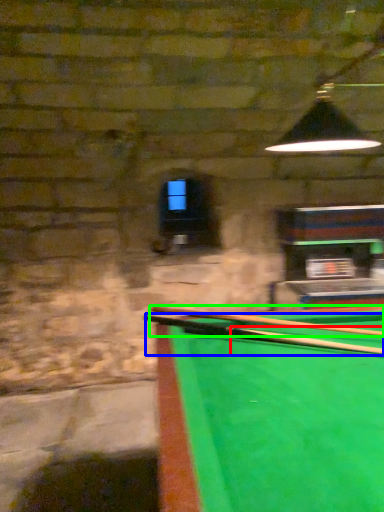
Question: Considering the real-world distances, which object is farthest from cue (highlighted by a red box)? cue (highlighted by a blue box) or cue (highlighted by a green box)?

Choices:
 (A) cue
 (B) cue

Answer: (B)